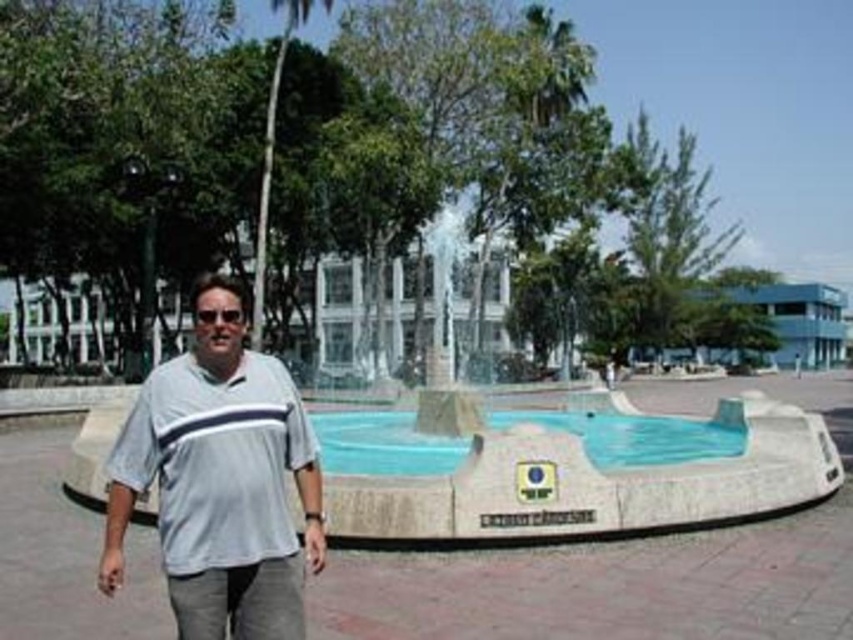
You are a photographer trying to capture a shot of the clear blue water at center and the green leafy palm tree at upper center. Which object appears wider in the frame?

The green leafy palm tree at upper center appears wider in the frame than the clear blue water at center.

You are standing at the point marked as point (367, 449) and want to take a photo of the fountain. The camera you are using has a focal length of 50mm and a sensor size of 36mm. What is the minimum distance you need to move towards the fountain to ensure the entire fountain fits within the camera frame?

The point (367, 449) is 36.33 feet away from the camera. To calculate the minimum distance to move closer, first determine the field of view using the formula Field of View Angle in degrees equals 2 times arctangent of sensor size divided by 2 multiplied by focal length. Plugging in the values gives an angle of approximately 39.9 degrees. Next, compute the required distance using the formula Distance equals height of object divided by tangent of half the field of view angle. Assuming the fountain height H